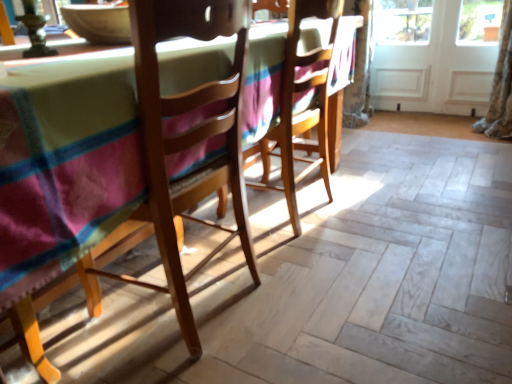
Where is `wooden chair at left, acting as the 1th chair starting from the front`? This screenshot has height=384, width=512. wooden chair at left, acting as the 1th chair starting from the front is located at coordinates (184, 144).

From a real-world perspective, is wooden chair at left, the second chair viewed from the back, positioned under white wooden screen door at right, arranged as the first screen door when viewed from the left, based on gravity?

Incorrect, from a real-world perspective, wooden chair at left, the second chair viewed from the back, is higher than white wooden screen door at right, arranged as the first screen door when viewed from the left.

Considering the relative sizes of wooden chair at left, the second chair viewed from the back, and white wooden screen door at right, marked as the second screen door in a right-to-left arrangement, in the image provided, is wooden chair at left, the second chair viewed from the back, bigger than white wooden screen door at right, marked as the second screen door in a right-to-left arrangement,?

Indeed, wooden chair at left, the second chair viewed from the back, has a larger size compared to white wooden screen door at right, marked as the second screen door in a right-to-left arrangement.

Between wooden chair at left, the second chair viewed from the back, and white wooden screen door at right, arranged as the first screen door when viewed from the left, which one appears on the left side from the viewer's perspective?

Positioned to the left is wooden chair at left, the second chair viewed from the back.

Does point (189, 332) appear closer or farther from the camera than point (424, 31)?

Clearly, point (189, 332) is closer to the camera than point (424, 31).

Is wooden chair at left, acting as the 1th chair starting from the front, surrounding wooden chair at center, the 2th chair when ordered from front to back?

No, wooden chair at center, the 2th chair when ordered from front to back, is located outside of wooden chair at left, acting as the 1th chair starting from the front.

Is wooden chair at left, acting as the 1th chair starting from the front, beside wooden chair at center, the first chair from the back?

wooden chair at left, acting as the 1th chair starting from the front, and wooden chair at center, the first chair from the back, are clearly separated.

In terms of size, does wooden chair at left, acting as the 1th chair starting from the front, appear bigger or smaller than wooden chair at center, the 2th chair when ordered from front to back?

Clearly, wooden chair at left, acting as the 1th chair starting from the front, is smaller in size than wooden chair at center, the 2th chair when ordered from front to back.

Which is behind, point (94, 299) or point (283, 77)?

The point (283, 77) is behind.

Could you tell me if white wood screen door at upper right, which is the first screen door in right-to-left order, is turned towards white wooden screen door at right, marked as the second screen door in a right-to-left arrangement?

Yes, white wood screen door at upper right, which is the first screen door in right-to-left order, is turned towards white wooden screen door at right, marked as the second screen door in a right-to-left arrangement.

Is white wooden screen door at right, marked as the second screen door in a right-to-left arrangement, inside white wood screen door at upper right, which is the first screen door in right-to-left order?

Yes.

Considering the positions of objects white wood screen door at upper right, which is the first screen door in right-to-left order, and white wooden screen door at right, arranged as the first screen door when viewed from the left, in the image provided, who is behind, white wood screen door at upper right, which is the first screen door in right-to-left order, or white wooden screen door at right, arranged as the first screen door when viewed from the left,?

white wooden screen door at right, arranged as the first screen door when viewed from the left, is further from the camera.

Looking at this image, is white wood screen door at upper right, which is the first screen door in right-to-left order, to the right of wooden chair at left, acting as the 1th chair starting from the front, from the viewer's perspective?

Correct, you'll find white wood screen door at upper right, which is the first screen door in right-to-left order, to the right of wooden chair at left, acting as the 1th chair starting from the front.

Considering the sizes of white wood screen door at upper right, which is the first screen door in right-to-left order, and wooden chair at left, acting as the 1th chair starting from the front, in the image, is white wood screen door at upper right, which is the first screen door in right-to-left order, taller or shorter than wooden chair at left, acting as the 1th chair starting from the front,?

white wood screen door at upper right, which is the first screen door in right-to-left order, is shorter than wooden chair at left, acting as the 1th chair starting from the front.

From the image's perspective, is white wood screen door at upper right, which is the first screen door in right-to-left order, under wooden chair at left, acting as the 1th chair starting from the front?

No.

Is wooden chair at left, the second chair viewed from the back, directly adjacent to white wood screen door at upper right, which is the 2th screen door from left to right?

No, wooden chair at left, the second chair viewed from the back, is not with white wood screen door at upper right, which is the 2th screen door from left to right.

From the picture: Is wooden chair at left, acting as the 1th chair starting from the front, spatially inside white wood screen door at upper right, which is the 2th screen door from left to right, or outside of it?

wooden chair at left, acting as the 1th chair starting from the front, is not enclosed by white wood screen door at upper right, which is the 2th screen door from left to right.

Considering the relative sizes of wooden chair at left, acting as the 1th chair starting from the front, and white wood screen door at upper right, which is the first screen door in right-to-left order, in the image provided, is wooden chair at left, acting as the 1th chair starting from the front, smaller than white wood screen door at upper right, which is the first screen door in right-to-left order,?

Incorrect, wooden chair at left, acting as the 1th chair starting from the front, is not smaller in size than white wood screen door at upper right, which is the first screen door in right-to-left order.

At what (x,y) coordinates should I click in order to perform the action: click on the 2nd screen door behind the wooden chair at center, the first chair from the back. Please return your answer as a coordinate pair (x, y). This screenshot has width=512, height=384. Looking at the image, I should click on (401, 53).

Is white wooden screen door at right, arranged as the first screen door when viewed from the left, facing towards wooden chair at center, the first chair from the back?

Yes.

Which point is more distant from viewer, (421, 48) or (311, 81)?

The point (421, 48) is behind.

Between white wooden screen door at right, arranged as the first screen door when viewed from the left, and wooden chair at center, the 2th chair when ordered from front to back, which one is positioned behind?

white wooden screen door at right, arranged as the first screen door when viewed from the left, is more distant.

From a real-world perspective, between white wooden screen door at right, arranged as the first screen door when viewed from the left, and white wood screen door at upper right, which is the 2th screen door from left to right, who is vertically lower?

From a 3D spatial view, white wood screen door at upper right, which is the 2th screen door from left to right, is below.

Considering the positions of objects white wooden screen door at right, arranged as the first screen door when viewed from the left, and white wood screen door at upper right, which is the 2th screen door from left to right, in the image provided, who is more to the left, white wooden screen door at right, arranged as the first screen door when viewed from the left, or white wood screen door at upper right, which is the 2th screen door from left to right,?

Positioned to the left is white wooden screen door at right, arranged as the first screen door when viewed from the left.

Does white wooden screen door at right, marked as the second screen door in a right-to-left arrangement, have a smaller size compared to white wood screen door at upper right, which is the first screen door in right-to-left order?

Yes, white wooden screen door at right, marked as the second screen door in a right-to-left arrangement, is smaller than white wood screen door at upper right, which is the first screen door in right-to-left order.

Does white wooden screen door at right, marked as the second screen door in a right-to-left arrangement, turn towards white wood screen door at upper right, which is the first screen door in right-to-left order?

Yes.

Find the location of `chair that is the 2nd one above the white wooden screen door at right, arranged as the first screen door when viewed from the left (from a real-world perspective)`. chair that is the 2nd one above the white wooden screen door at right, arranged as the first screen door when viewed from the left (from a real-world perspective) is located at coordinates (184, 144).

This screenshot has width=512, height=384. Find the location of `chair located above the wooden chair at left, acting as the 1th chair starting from the front (from the image's perspective)`. chair located above the wooden chair at left, acting as the 1th chair starting from the front (from the image's perspective) is located at coordinates (303, 111).

Looking at the image, which one is located further to white wood screen door at upper right, which is the first screen door in right-to-left order, wooden chair at center, the first chair from the back, or white wooden screen door at right, marked as the second screen door in a right-to-left arrangement?

The object further to white wood screen door at upper right, which is the first screen door in right-to-left order, is wooden chair at center, the first chair from the back.

Which object lies further to the anchor point white wooden screen door at right, arranged as the first screen door when viewed from the left, wooden chair at left, the second chair viewed from the back, or white wood screen door at upper right, which is the 2th screen door from left to right?

Among the two, wooden chair at left, the second chair viewed from the back, is located further to white wooden screen door at right, arranged as the first screen door when viewed from the left.

Looking at this image, when comparing their distances from white wood screen door at upper right, which is the first screen door in right-to-left order, does white wooden screen door at right, arranged as the first screen door when viewed from the left, or wooden chair at center, the 2th chair when ordered from front to back, seem further?

wooden chair at center, the 2th chair when ordered from front to back, is positioned further to the anchor white wood screen door at upper right, which is the first screen door in right-to-left order.

When comparing their distances from wooden chair at center, the 2th chair when ordered from front to back, does white wooden screen door at right, arranged as the first screen door when viewed from the left, or wooden chair at left, acting as the 1th chair starting from the front, seem closer?

wooden chair at left, acting as the 1th chair starting from the front.

When comparing their distances from wooden chair at left, acting as the 1th chair starting from the front, does white wood screen door at upper right, which is the 2th screen door from left to right, or wooden chair at center, the first chair from the back, seem closer?

wooden chair at center, the first chair from the back, is closer to wooden chair at left, acting as the 1th chair starting from the front.

Considering their positions, is wooden chair at center, the 2th chair when ordered from front to back, positioned closer to wooden chair at left, the second chair viewed from the back, than white wooden screen door at right, arranged as the first screen door when viewed from the left?

Among the two, wooden chair at center, the 2th chair when ordered from front to back, is located nearer to wooden chair at left, the second chair viewed from the back.

From the image, which object appears to be nearer to wooden chair at left, the second chair viewed from the back, white wood screen door at upper right, which is the 2th screen door from left to right, or white wooden screen door at right, arranged as the first screen door when viewed from the left?

white wood screen door at upper right, which is the 2th screen door from left to right, is closer to wooden chair at left, the second chair viewed from the back.

Estimate the real-world distances between objects in this image. Which object is closer to white wooden screen door at right, marked as the second screen door in a right-to-left arrangement, wooden chair at center, the first chair from the back, or white wood screen door at upper right, which is the 2th screen door from left to right?

Based on the image, white wood screen door at upper right, which is the 2th screen door from left to right, appears to be nearer to white wooden screen door at right, marked as the second screen door in a right-to-left arrangement.

Locate an element on the screen. This screenshot has width=512, height=384. chair between wooden chair at left, acting as the 1th chair starting from the front, and white wood screen door at upper right, which is the 2th screen door from left to right, along the z-axis is located at coordinates (303, 111).

You are a GUI agent. You are given a task and a screenshot of the screen. Output one action in this format:
    pyautogui.click(x=<x>, y=<y>)
    Task: Click on the screen door located between wooden chair at center, the first chair from the back, and white wooden screen door at right, marked as the second screen door in a right-to-left arrangement, in the depth direction
    This screenshot has width=512, height=384.
    Given the screenshot: What is the action you would take?
    pyautogui.click(x=435, y=56)

This screenshot has height=384, width=512. What are the coordinates of `screen door located between wooden chair at left, the second chair viewed from the back, and white wooden screen door at right, arranged as the first screen door when viewed from the left, in the depth direction` in the screenshot? It's located at (435, 56).

This screenshot has height=384, width=512. What are the coordinates of `chair between wooden chair at left, the second chair viewed from the back, and white wooden screen door at right, marked as the second screen door in a right-to-left arrangement, in the front-back direction` in the screenshot? It's located at (303, 111).